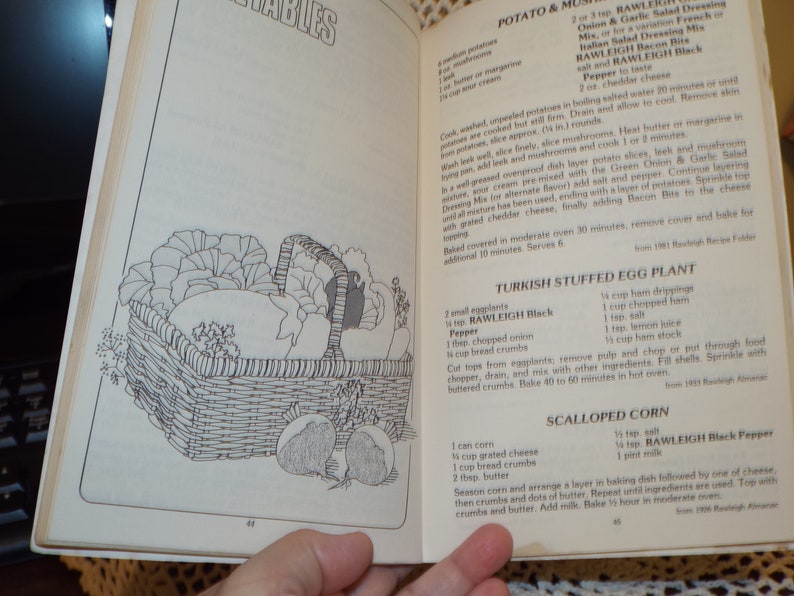
Locate an element on the screen. Image resolution: width=794 pixels, height=596 pixels. wall is located at coordinates (783, 20).